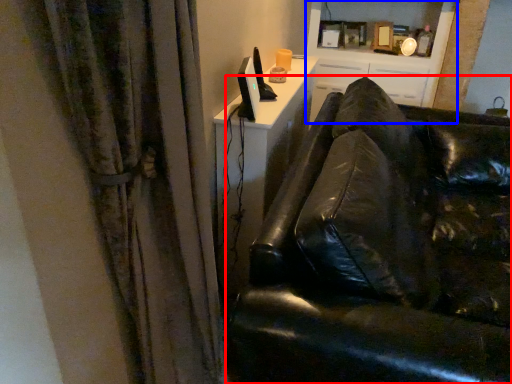
Question: Among these objects, which one is farthest to the camera, studio couch (highlighted by a red box) or entertainment center (highlighted by a blue box)?

Choices:
 (A) studio couch
 (B) entertainment center

Answer: (B)